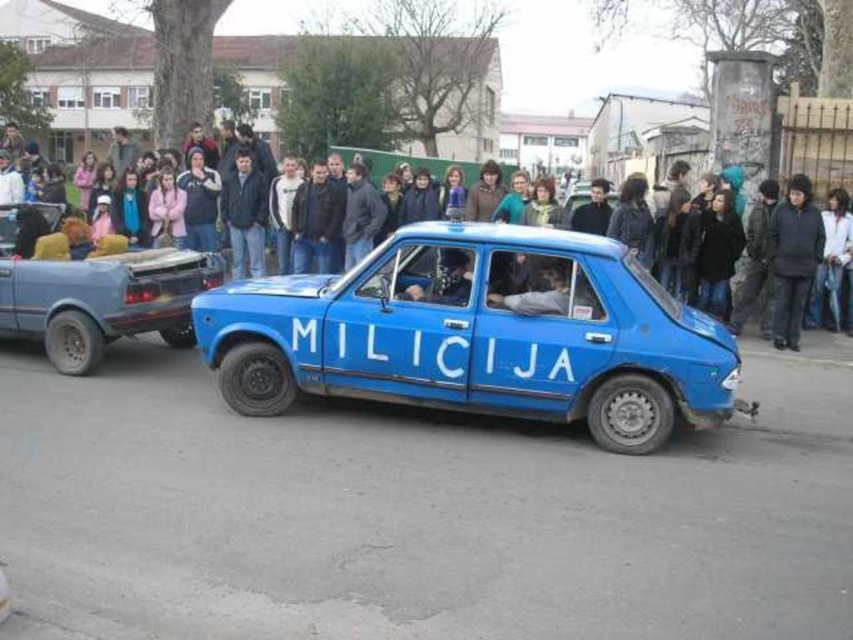
Which is behind, point (1, 221) or point (45, 166)?

Positioned behind is point (45, 166).

Is rusty metal pickup truck at left below dark blue clothing at center?

Indeed, rusty metal pickup truck at left is positioned under dark blue clothing at center.

You are a GUI agent. You are given a task and a screenshot of the screen. Output one action in this format:
    pyautogui.click(x=<x>, y=<y>)
    Task: Click on the rusty metal pickup truck at left
    This screenshot has height=640, width=853.
    Given the screenshot: What is the action you would take?
    pyautogui.click(x=97, y=296)

Does point (548, 323) come behind point (39, 330)?

That is False.

Find the location of `blue matte car at center`. blue matte car at center is located at coordinates (479, 333).

This screenshot has width=853, height=640. Find the location of `blue matte car at center`. blue matte car at center is located at coordinates (479, 333).

Does blue matte car at center come behind dark blue clothing at center?

That is False.

Which is in front, point (608, 376) or point (170, 198)?

Point (608, 376)

Is point (621, 346) positioned before point (3, 161)?

Yes, point (621, 346) is in front of point (3, 161).

Locate an element on the screen. The height and width of the screenshot is (640, 853). blue matte car at center is located at coordinates (479, 333).